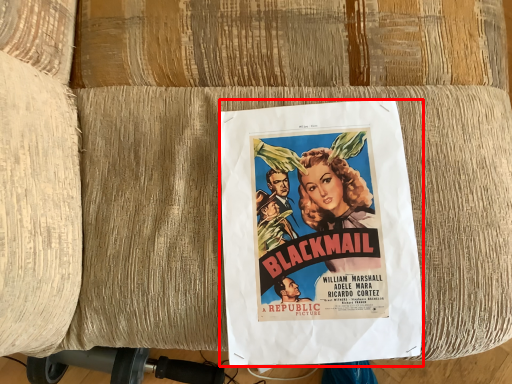
Question: From the image's perspective, considering the relative positions of poster (annotated by the red box) and vacuum in the image provided, where is poster (annotated by the red box) located with respect to the staircase?

Choices:
 (A) below
 (B) above

Answer: (B)